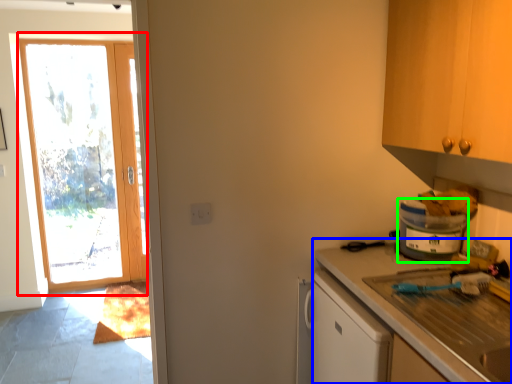
Question: Which is farther away from door (highlighted by a red box)? countertop (highlighted by a blue box) or appliance (highlighted by a green box)?

Choices:
 (A) countertop
 (B) appliance

Answer: (B)